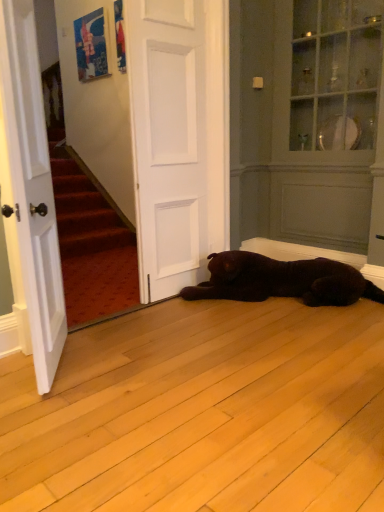
At what (x,y) coordinates should I click in order to perform the action: click on space that is in front of white wood door at left, which appears as the first door when viewed from the left. Please return your answer as a coordinate pair (x, y). Looking at the image, I should click on (48, 409).